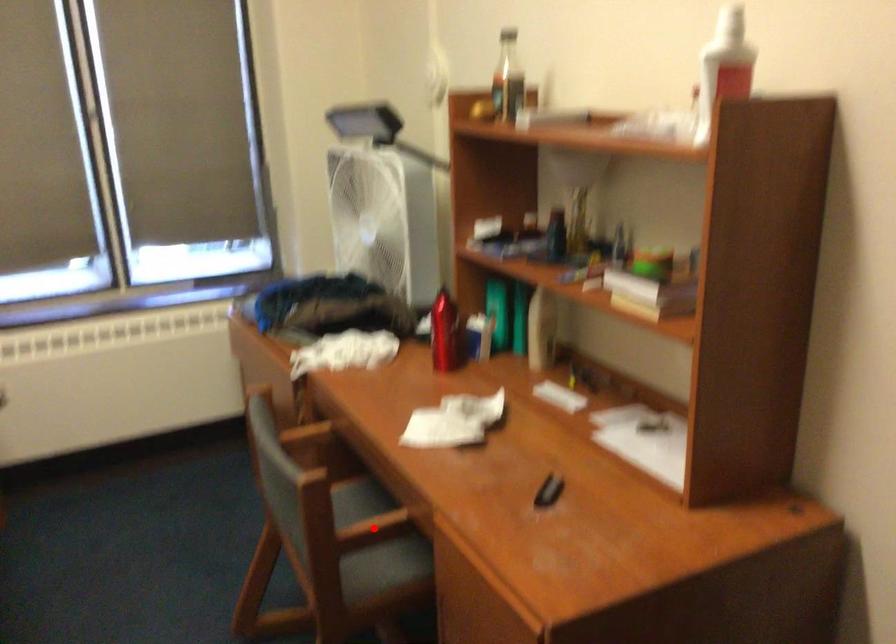
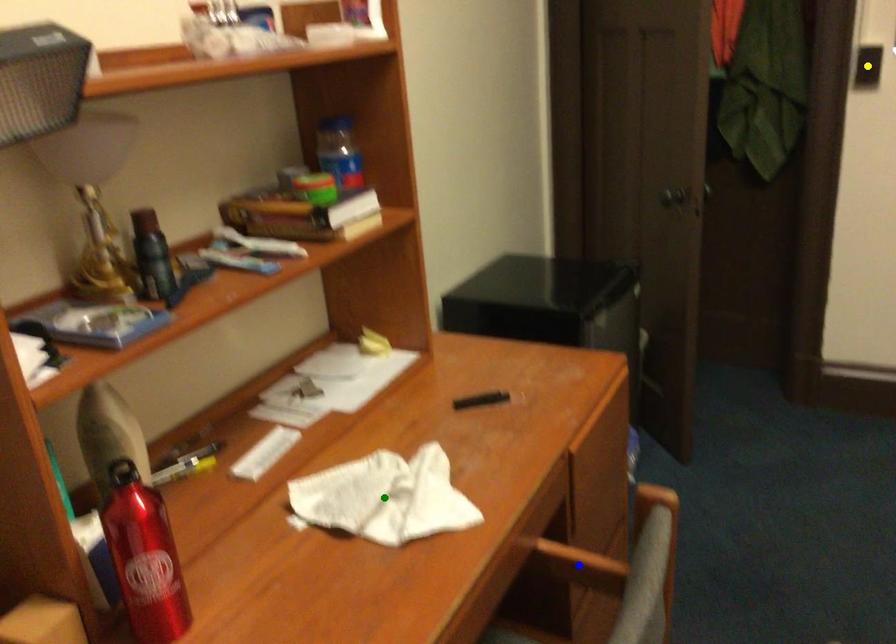
Question: I am providing you with two images of the same scene from different viewpoints. A red point is marked on the first image. You are given multiple points on the second image. Which mark in image 2 goes with the point in image 1?

Choices:
 (A) yellow point
 (B) green point
 (C) blue point

Answer: (C)